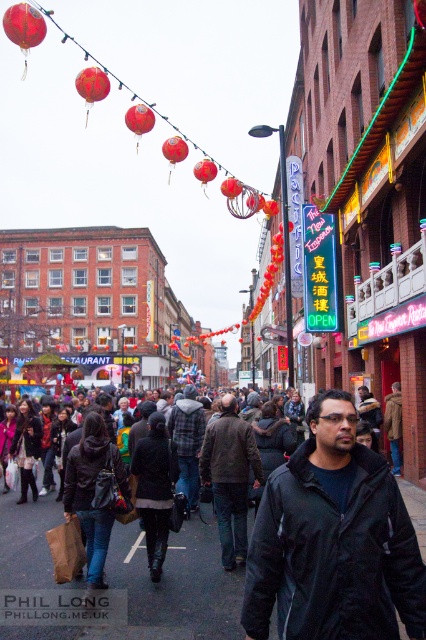
Question: Estimate the real-world distances between objects in this image. Which object is farther from the matte red lantern at upper center?

Choices:
 (A) red glossy lantern at upper left
 (B) red paper lantern at center

Answer: (A)

Question: Which object is the farthest from the black matte jacket at center?

Choices:
 (A) red matte lantern at upper center
 (B) dark blue leather jacket at center

Answer: (A)

Question: Does black leather jacket at center have a greater width compared to matte red lantern at upper center?

Choices:
 (A) yes
 (B) no

Answer: (B)

Question: Does black matte jacket at center come behind matte red lantern at upper center?

Choices:
 (A) yes
 (B) no

Answer: (B)

Question: Does dark blue leather jacket at center appear on the left side of red paper lantern at center?

Choices:
 (A) yes
 (B) no

Answer: (A)

Question: Among these objects, which one is farthest from the camera?

Choices:
 (A) red glossy lantern at upper left
 (B) red glossy lantern at center
 (C) dark blue leather jacket at center
 (D) black leather jacket at center

Answer: (B)